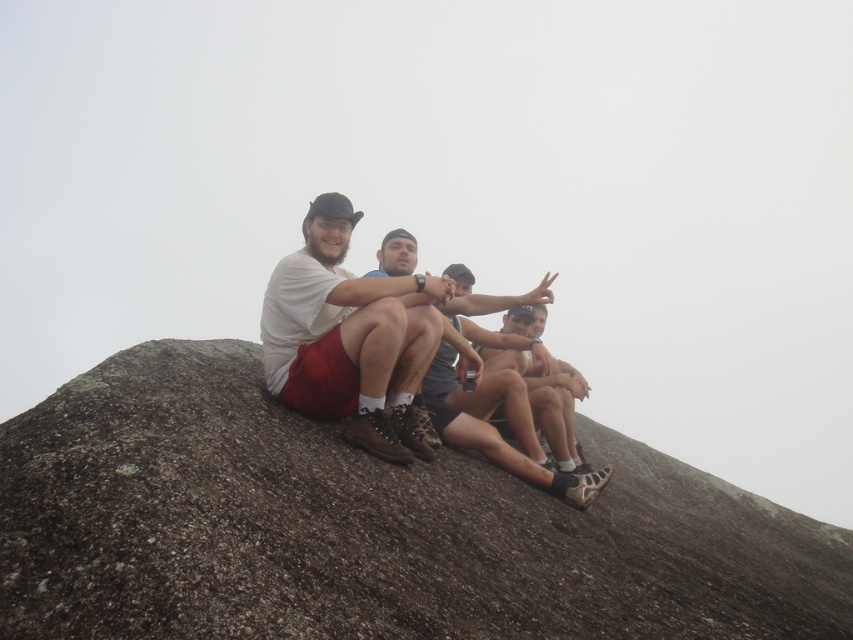
Does brown rough rock at center have a greater height compared to matte white t-shirt at center?

Correct, brown rough rock at center is much taller as matte white t-shirt at center.

The image size is (853, 640). What are the coordinates of `brown rough rock at center` in the screenshot? It's located at (367, 528).